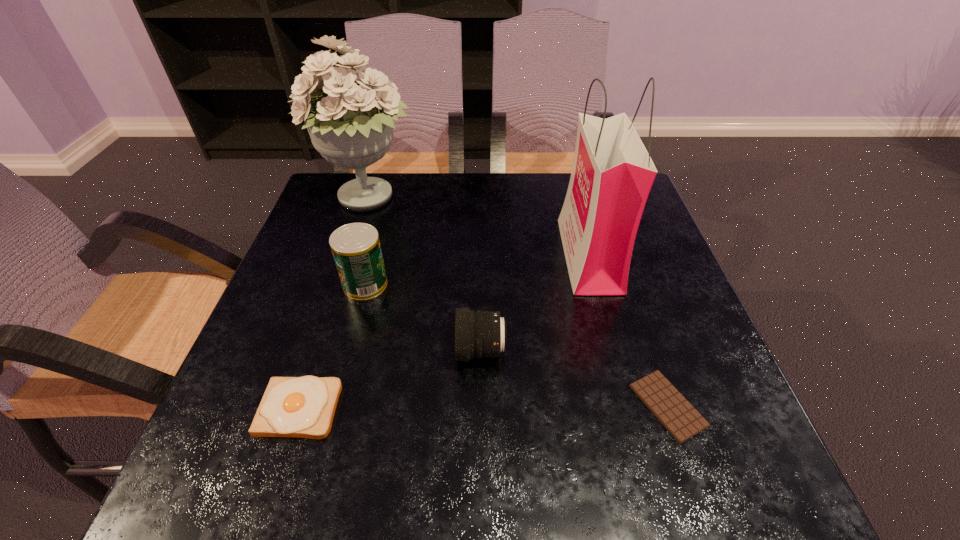
Image resolution: width=960 pixels, height=540 pixels. In the image, there is a desktop. Identify the location of vacant space at the left edge. (240, 364).

Where is `vacant space at the right edge`? vacant space at the right edge is located at coordinates (677, 310).

Locate an element on the screen. The height and width of the screenshot is (540, 960). free point between the shortest object and the third tallest object is located at coordinates (516, 345).

You are a GUI agent. You are given a task and a screenshot of the screen. Output one action in this format:
    pyautogui.click(x=<x>, y=<y>)
    Task: Click on the vacant point located between the fourth shortest object and the toast
    The width and height of the screenshot is (960, 540).
    Given the screenshot: What is the action you would take?
    pyautogui.click(x=332, y=346)

Image resolution: width=960 pixels, height=540 pixels. What are the coordinates of `unoccupied area between the fourth object from left to right and the fifth tallest object` in the screenshot? It's located at (391, 380).

Image resolution: width=960 pixels, height=540 pixels. Identify the location of blank region between the toast and the shopping bag. (444, 332).

I want to click on free spot between the toast and the bouquet, so click(334, 304).

Locate an element on the screen. Image resolution: width=960 pixels, height=540 pixels. vacant region between the second shortest object and the bouquet is located at coordinates (334, 304).

Where is `vacant space that's between the shopping bag and the chocolate bar`? The image size is (960, 540). vacant space that's between the shopping bag and the chocolate bar is located at coordinates (628, 330).

Locate an element on the screen. vacant area between the bouquet and the second shortest object is located at coordinates (334, 304).